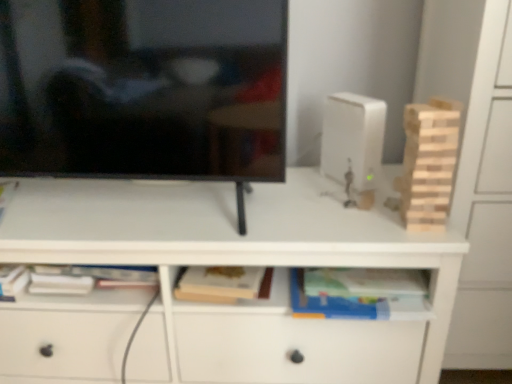
Identify the location of vacant space situated above hardcover book at center (from a real-world perspective). Image resolution: width=512 pixels, height=384 pixels. (357, 279).